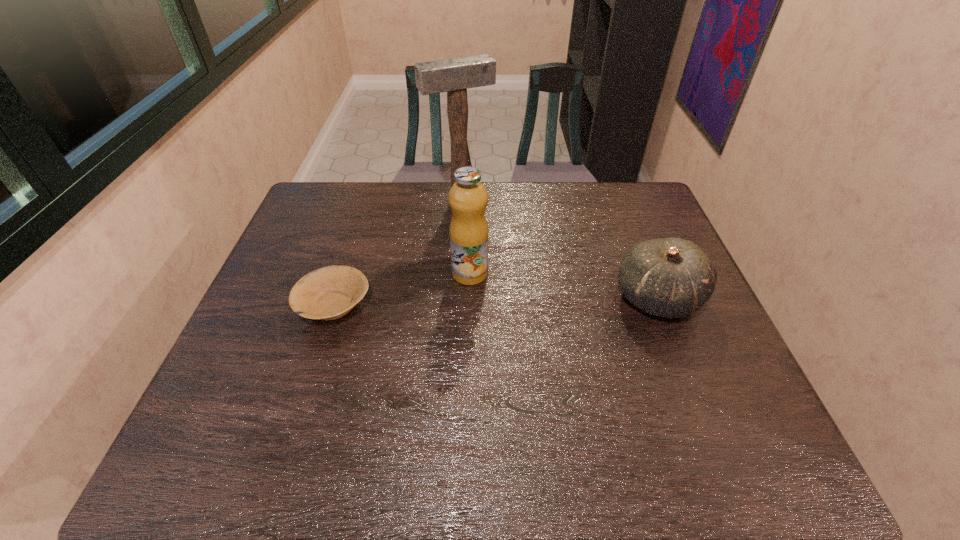
The height and width of the screenshot is (540, 960). Identify the location of vacant space on the desktop that is between the leftmost object and the gourd and is positioned on the striking surface of the farthest object. (524, 301).

This screenshot has width=960, height=540. I want to click on free space on the desktop that is between the shortest object and the rightmost object and is positioned on the front label of the third shortest object, so click(x=537, y=301).